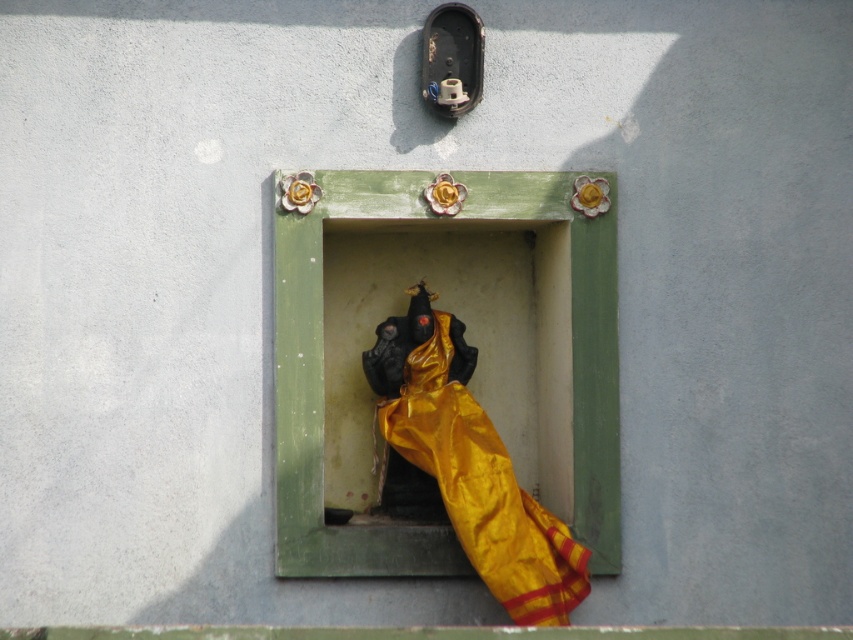
Question: Is green painted wood at center wider than gold silk cloth at center?

Choices:
 (A) no
 (B) yes

Answer: (B)

Question: Can you confirm if green painted wood at center is thinner than gold silk cloth at center?

Choices:
 (A) no
 (B) yes

Answer: (A)

Question: Which object appears closest to the camera in this image?

Choices:
 (A) gold silk cloth at center
 (B) green painted wood at center

Answer: (A)

Question: Among these objects, which one is farthest from the camera?

Choices:
 (A) green painted wood at center
 (B) gold silk cloth at center

Answer: (A)

Question: Can you confirm if green painted wood at center is wider than gold silk cloth at center?

Choices:
 (A) yes
 (B) no

Answer: (A)